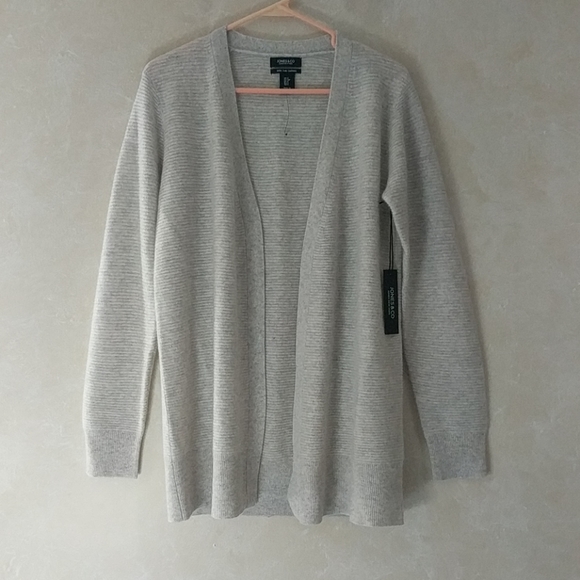
Find the location of a particular element. The width and height of the screenshot is (580, 580). wall is located at coordinates (519, 151).